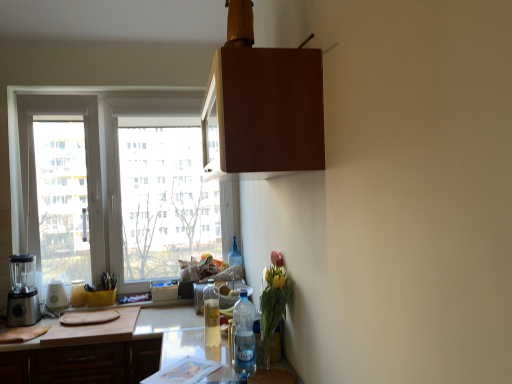
Question: Which direction should I rotate to look at clear plastic bottle at center, which ranks as the third appliance in left-to-right order, — up or down?

Choices:
 (A) up
 (B) down

Answer: (B)

Question: From the image's perspective, is clear glass bottle at center, arranged as the third bottle when viewed from the back, located beneath white plastic toaster at left, which ranks as the 2th appliance in left-to-right order?

Choices:
 (A) yes
 (B) no

Answer: (B)

Question: Does clear glass bottle at center, the 2th bottle positioned from the left, have a lesser height compared to white plastic toaster at left, marked as the 2th appliance in a right-to-left arrangement?

Choices:
 (A) yes
 (B) no

Answer: (B)

Question: Does clear glass bottle at center, the 2th bottle positioned from the left, turn towards white plastic toaster at left, which ranks as the 2th appliance in left-to-right order?

Choices:
 (A) no
 (B) yes

Answer: (A)

Question: Is clear glass bottle at center, which is the 3th bottle in right-to-left order, positioned behind white plastic toaster at left, which ranks as the 2th appliance in left-to-right order?

Choices:
 (A) no
 (B) yes

Answer: (A)

Question: Are clear glass bottle at center, which is the 3th bottle in right-to-left order, and white plastic toaster at left, marked as the 2th appliance in a right-to-left arrangement, far apart?

Choices:
 (A) no
 (B) yes

Answer: (B)

Question: Is clear glass bottle at center, marked as the second bottle in a front-to-back arrangement, closer to camera compared to white plastic toaster at left, which ranks as the 2th appliance in left-to-right order?

Choices:
 (A) yes
 (B) no

Answer: (A)

Question: Is white plastic toaster at left, marked as the 2th appliance in a right-to-left arrangement, in contact with clear glass bottle at center, marked as the second bottle in a front-to-back arrangement?

Choices:
 (A) yes
 (B) no

Answer: (B)

Question: From a real-world perspective, is white plastic toaster at left, which ranks as the 2th appliance in left-to-right order, physically below clear glass bottle at center, the 2th bottle positioned from the left?

Choices:
 (A) no
 (B) yes

Answer: (B)

Question: Is white plastic toaster at left, which ranks as the 2th appliance in left-to-right order, bigger than clear glass bottle at center, arranged as the third bottle when viewed from the back?

Choices:
 (A) yes
 (B) no

Answer: (B)

Question: Are white plastic toaster at left, which ranks as the 2th appliance in left-to-right order, and clear glass bottle at center, the 2th bottle positioned from the left, located far from each other?

Choices:
 (A) no
 (B) yes

Answer: (B)

Question: Does white plastic toaster at left, which ranks as the 2th appliance in left-to-right order, have a greater width compared to clear glass bottle at center, marked as the second bottle in a front-to-back arrangement?

Choices:
 (A) yes
 (B) no

Answer: (A)

Question: Is white plastic toaster at left, marked as the 2th appliance in a right-to-left arrangement, shorter than clear glass bottle at center, arranged as the third bottle when viewed from the back?

Choices:
 (A) no
 (B) yes

Answer: (B)

Question: Are clear plastic bottle at lower center, which is the first bottle in front-to-back order, and clear plastic bottle at center, which appears as the 1th appliance when viewed from the right, far apart?

Choices:
 (A) no
 (B) yes

Answer: (A)